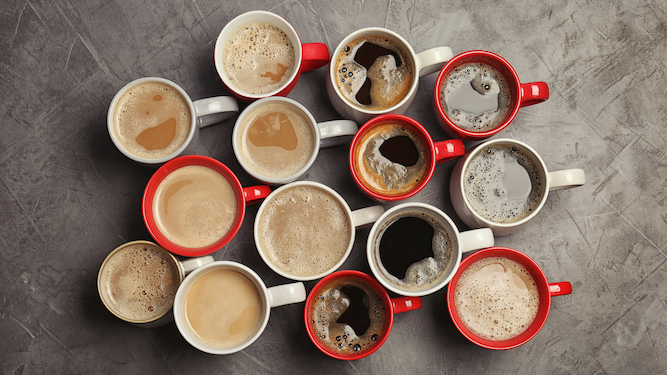
Where is `white mugs`? The height and width of the screenshot is (375, 667). white mugs is located at coordinates (119, 124), (267, 123), (299, 232), (125, 295), (203, 319), (419, 253), (509, 199), (389, 70).